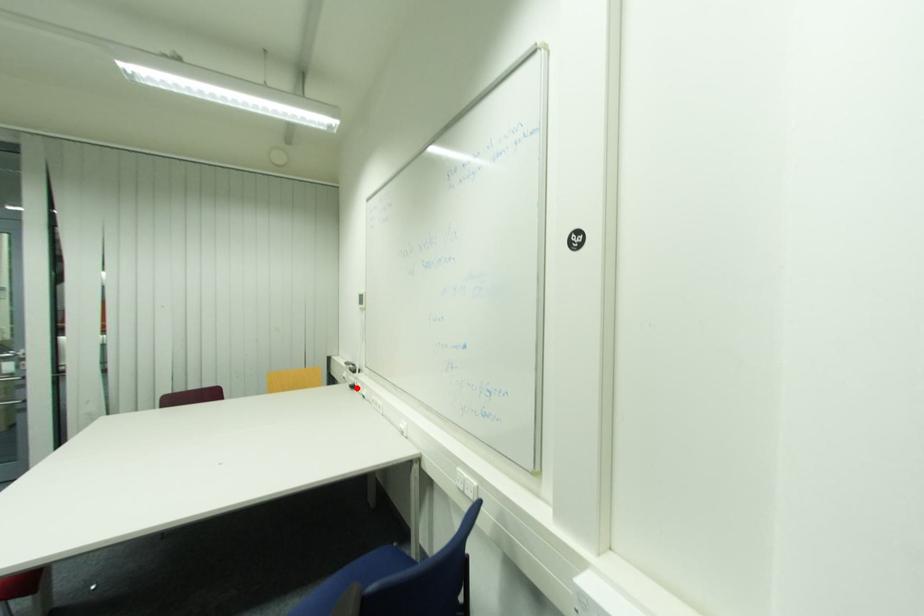
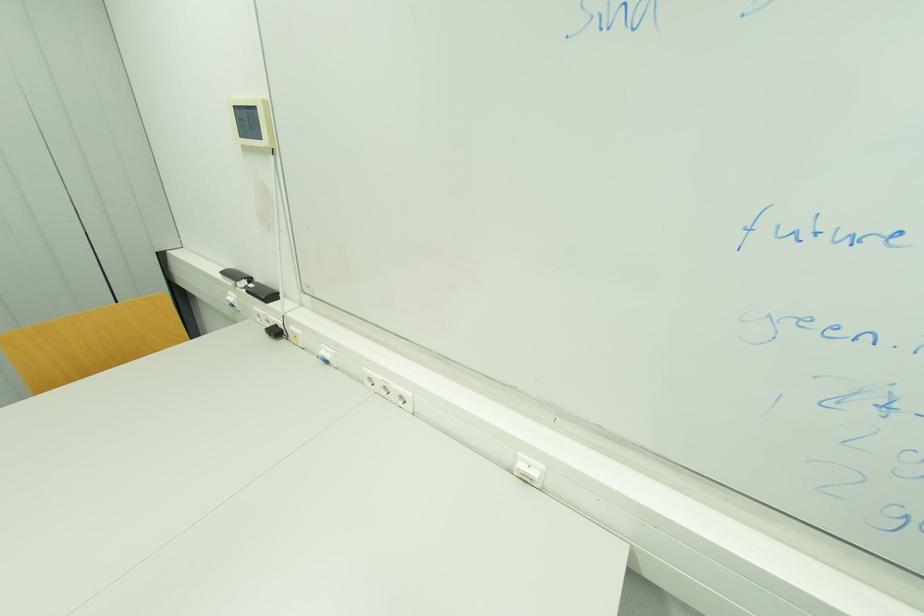
Question: I am providing you with two images of the same scene from different viewpoints. Image1 has a red point marked. In image2, the corresponding 3D location appears at what relative position? Reply with the corresponding letter.

Choices:
 (A) Closer
 (B) Farther

Answer: (A)